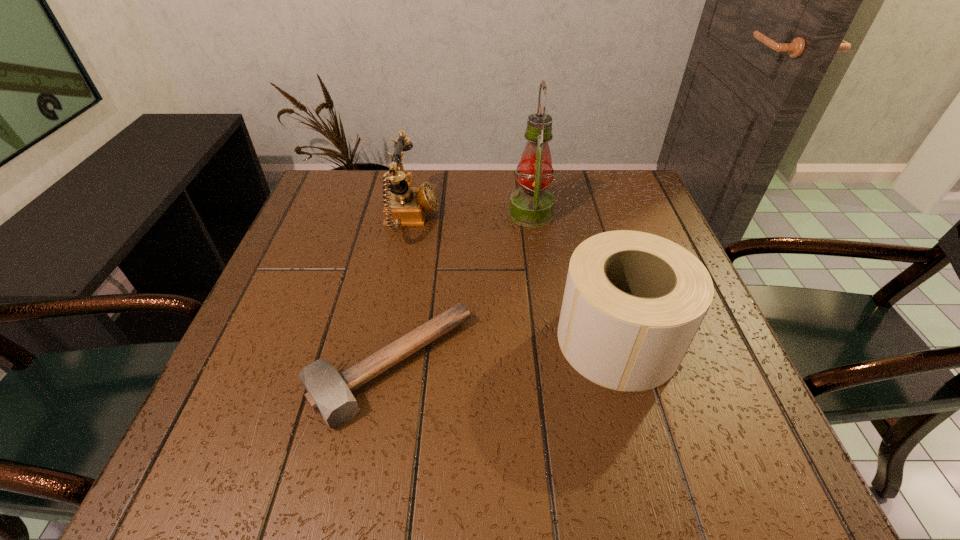
At what (x,y) coordinates should I click in order to perform the action: click on empty location between the toilet tissue and the shortest object. Please return your answer as a coordinate pair (x, y). Looking at the image, I should click on (504, 353).

I want to click on empty space that is in between the toilet tissue and the mallet, so click(504, 353).

Find the location of a particular element. The height and width of the screenshot is (540, 960). unoccupied position between the toilet tissue and the shortest object is located at coordinates (504, 353).

You are a GUI agent. You are given a task and a screenshot of the screen. Output one action in this format:
    pyautogui.click(x=<x>, y=<y>)
    Task: Click on the empty space between the shortest object and the toilet tissue
    
    Given the screenshot: What is the action you would take?
    (504, 353)

The height and width of the screenshot is (540, 960). I want to click on vacant area that lies between the tallest object and the mallet, so click(x=461, y=290).

Locate an element on the screen. Image resolution: width=960 pixels, height=540 pixels. vacant area that lies between the toilet tissue and the telephone is located at coordinates (515, 280).

At what (x,y) coordinates should I click in order to perform the action: click on free point between the shortest object and the tallest object. Please return your answer as a coordinate pair (x, y). This screenshot has height=540, width=960. Looking at the image, I should click on (461, 290).

In order to click on free point between the shortest object and the telephone in this screenshot , I will do `click(401, 293)`.

Point out which object is positioned as the second nearest to the telephone. Please provide its 2D coordinates. Your answer should be formatted as a tuple, i.e. [(x, y)], where the tuple contains the x and y coordinates of a point satisfying the conditions above.

[(328, 392)]

Select which object is the second closest to the mallet. Please provide its 2D coordinates. Your answer should be formatted as a tuple, i.e. [(x, y)], where the tuple contains the x and y coordinates of a point satisfying the conditions above.

[(405, 205)]